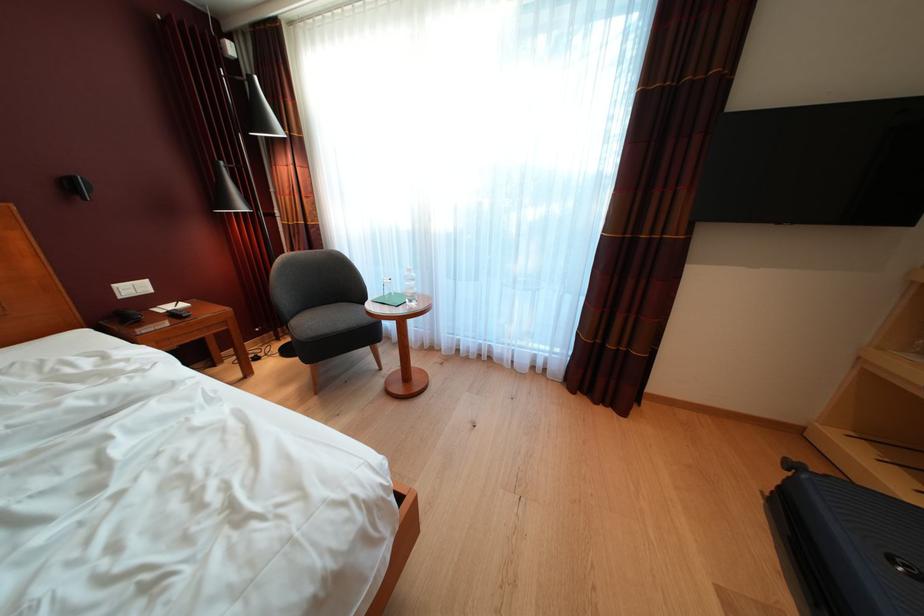
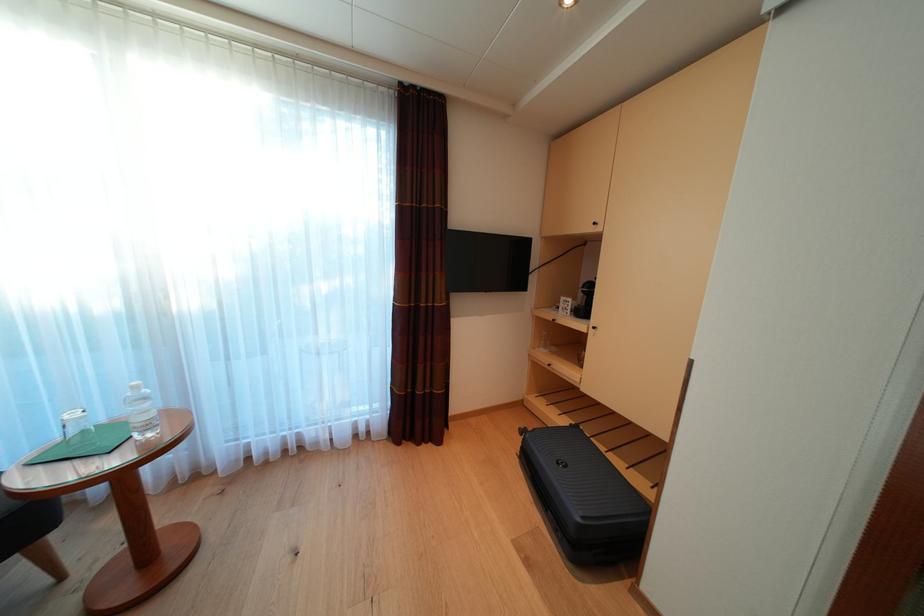
Question: The camera is either moving clockwise (left) or counter-clockwise (right) around the object. The first image is from the beginning of the video and the second image is from the end. Is the camera moving left or right when shooting the video?

Choices:
 (A) Left
 (B) Right

Answer: (A)